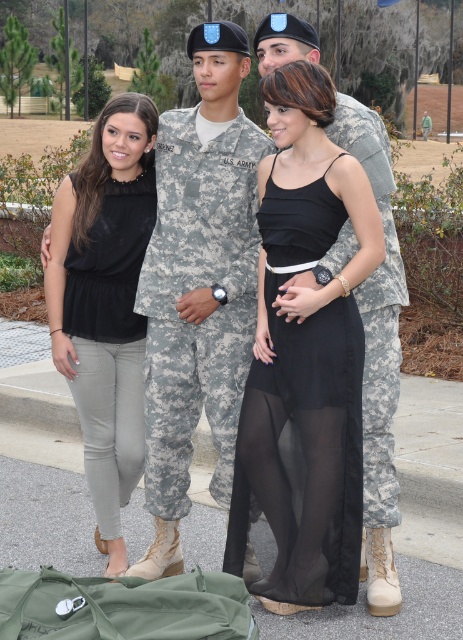
Does camouflage uniform at center have a greater height compared to camouflage fabric us army uniform at center?

Indeed, camouflage uniform at center has a greater height compared to camouflage fabric us army uniform at center.

Is camouflage uniform at center above camouflage fabric us army uniform at center?

Indeed, camouflage uniform at center is positioned over camouflage fabric us army uniform at center.

Find the location of a particular element. camouflage uniform at center is located at coordinates (199, 284).

Which is below, black sheer dress at center or camouflage uniform at center?

Positioned lower is black sheer dress at center.

This screenshot has width=463, height=640. In order to click on black sheer dress at center in this screenshot , I will do `click(306, 355)`.

At what (x,y) coordinates should I click in order to perform the action: click on black sheer dress at center. Please return your answer as a coordinate pair (x, y). The width and height of the screenshot is (463, 640). Looking at the image, I should click on (306, 355).

Does black sheer dress at center have a greater height compared to camouflage fabric us army uniform at center?

Indeed, black sheer dress at center has a greater height compared to camouflage fabric us army uniform at center.

Can you confirm if black sheer dress at center is thinner than camouflage fabric us army uniform at center?

Incorrect, black sheer dress at center's width is not less than camouflage fabric us army uniform at center's.

At what (x,y) coordinates should I click in order to perform the action: click on black sheer dress at center. Please return your answer as a coordinate pair (x, y). This screenshot has width=463, height=640. Looking at the image, I should click on (306, 355).